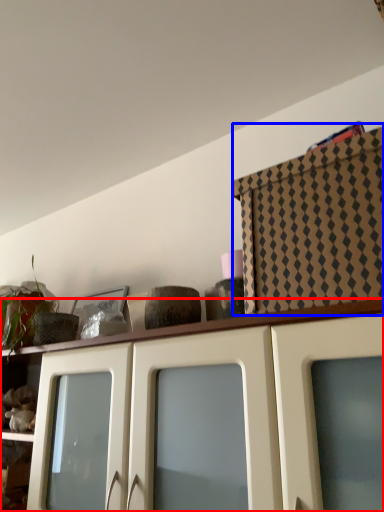
Question: Among these objects, which one is nearest to the camera, cabinetry (highlighted by a red box) or cabinetry (highlighted by a blue box)?

Choices:
 (A) cabinetry
 (B) cabinetry

Answer: (A)